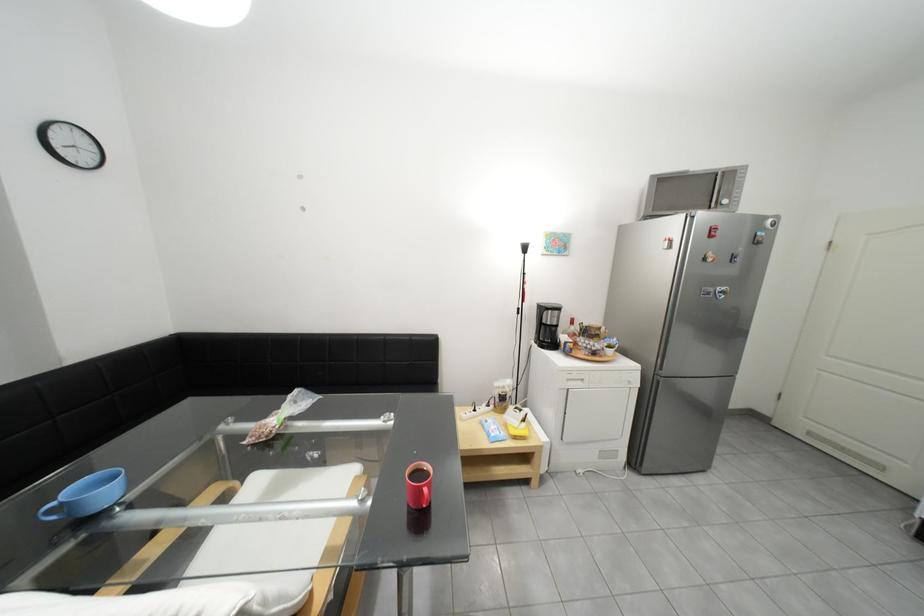
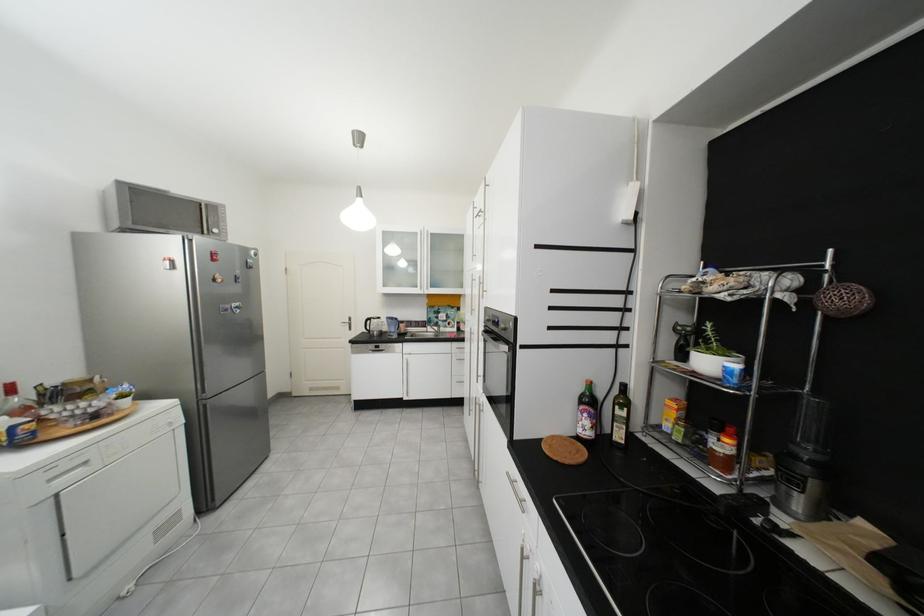
In the second image, find the point that corresponds to the point at 682,248 in the first image.

(185, 269)